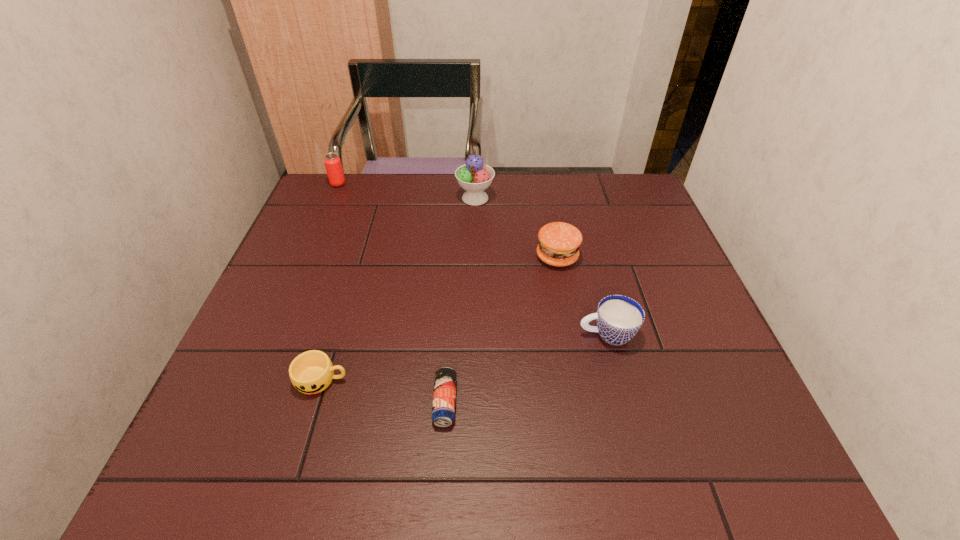
Locate an element on the screen. This screenshot has width=960, height=540. free space in the image that satisfies the following two spatial constraints: 1. on the back side of the nearer beer can; 2. on the right side of the fourth nearest object is located at coordinates (454, 257).

Locate an element on the screen. This screenshot has width=960, height=540. free location that satisfies the following two spatial constraints: 1. on the back side of the tallest object; 2. on the left side of the nearer beer can is located at coordinates (458, 198).